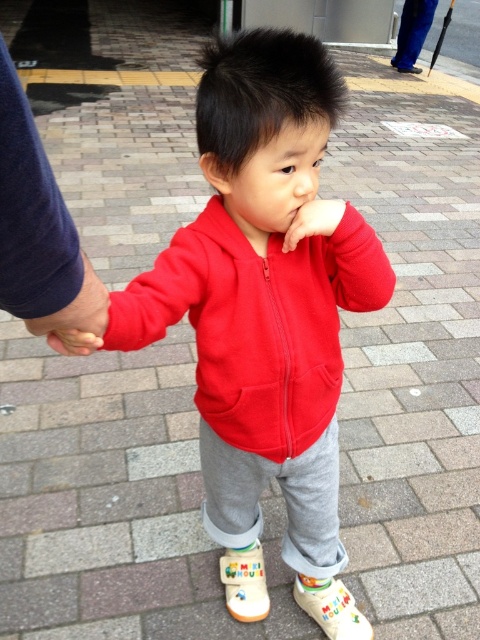
You are a fashion designer analyzing the image. You need to determine which item of clothing is larger between the matte fleece jacket at center and the white rubber shoe at lower right. Based on the scene, which one is bigger?

The matte fleece jacket at center is bigger than the white rubber shoe at lower right according to the description.

You are a photographer trying to capture a candid shot of the matte fleece jacket at center and the white rubber shoe at lower right. Based on their positions, which object should you focus on first to ensure both are in the frame?

The matte fleece jacket at center is below the white rubber shoe at lower right, so you should focus on the white rubber shoe at lower right first to ensure both are in the frame.